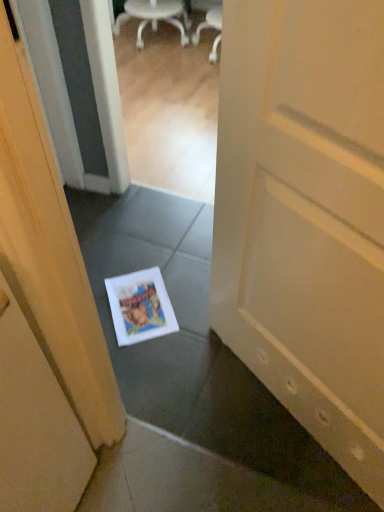
Question: Is white matte door at center smaller than white plastic chair at upper center?

Choices:
 (A) no
 (B) yes

Answer: (B)

Question: Is white matte door at center positioned beyond the bounds of white plastic chair at upper center?

Choices:
 (A) no
 (B) yes

Answer: (B)

Question: Does white matte door at center appear on the left side of white plastic chair at upper center?

Choices:
 (A) yes
 (B) no

Answer: (B)

Question: Could you tell me if white matte door at center is turned towards white plastic chair at upper center?

Choices:
 (A) no
 (B) yes

Answer: (A)

Question: Considering the relative sizes of white matte door at center and white plastic chair at upper center in the image provided, is white matte door at center bigger than white plastic chair at upper center?

Choices:
 (A) yes
 (B) no

Answer: (B)

Question: Looking at the image, does white matte magazine at center seem bigger or smaller compared to white matte door at center?

Choices:
 (A) big
 (B) small

Answer: (B)

Question: From a real-world perspective, is white matte magazine at center physically located above or below white matte door at center?

Choices:
 (A) below
 (B) above

Answer: (A)

Question: In the image, is white matte magazine at center on the left side or the right side of white matte door at center?

Choices:
 (A) right
 (B) left

Answer: (B)

Question: Is white matte magazine at center inside the boundaries of white matte door at center, or outside?

Choices:
 (A) inside
 (B) outside

Answer: (B)

Question: From a real-world perspective, is white plastic chair at upper center above or below white matte magazine at center?

Choices:
 (A) above
 (B) below

Answer: (A)

Question: Does point (147, 12) appear closer or farther from the camera than point (140, 313)?

Choices:
 (A) closer
 (B) farther

Answer: (B)

Question: Based on their sizes in the image, would you say white plastic chair at upper center is bigger or smaller than white matte magazine at center?

Choices:
 (A) big
 (B) small

Answer: (A)

Question: Looking at their shapes, would you say white plastic chair at upper center is wider or thinner than white matte magazine at center?

Choices:
 (A) thin
 (B) wide

Answer: (B)

Question: Is white matte door at center inside or outside of white plastic chair at upper center?

Choices:
 (A) inside
 (B) outside

Answer: (B)

Question: From the image's perspective, is white matte door at center above or below white plastic chair at upper center?

Choices:
 (A) below
 (B) above

Answer: (A)